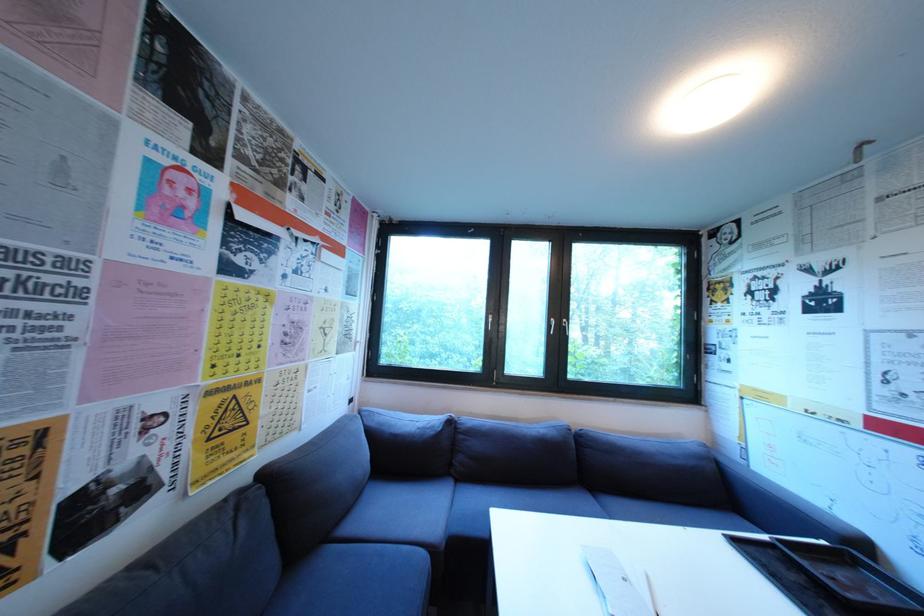
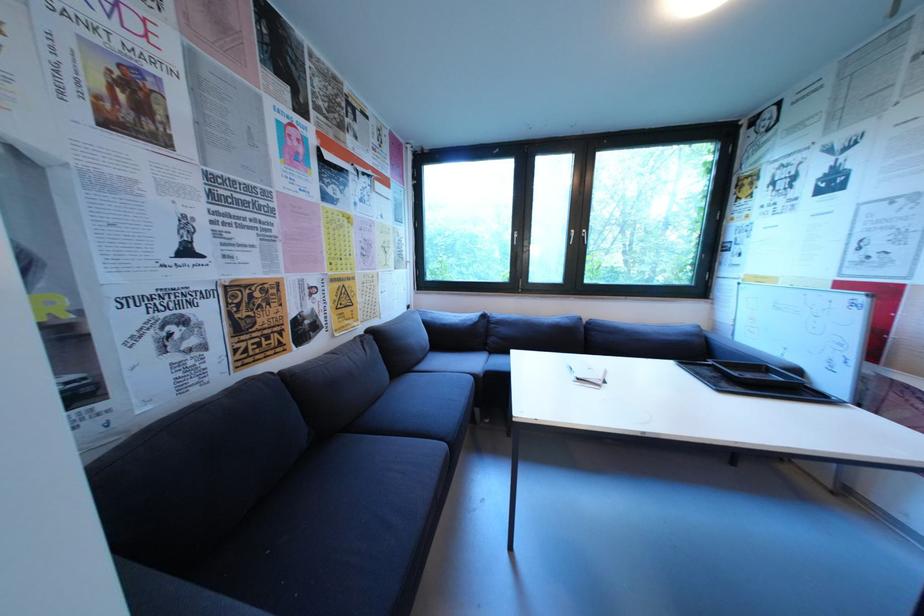
Question: Based on the continuous images, in which direction is the camera rotating? Reply with the corresponding letter.

Choices:
 (A) Left
 (B) Right
 (C) Up
 (D) Down

Answer: (D)